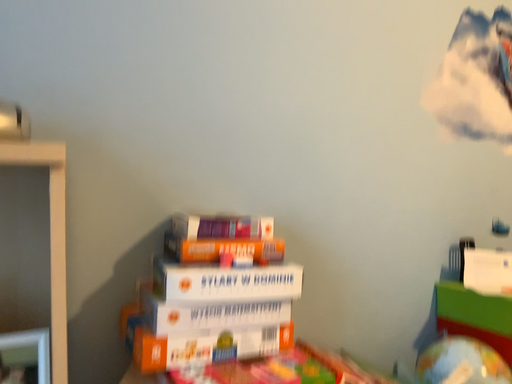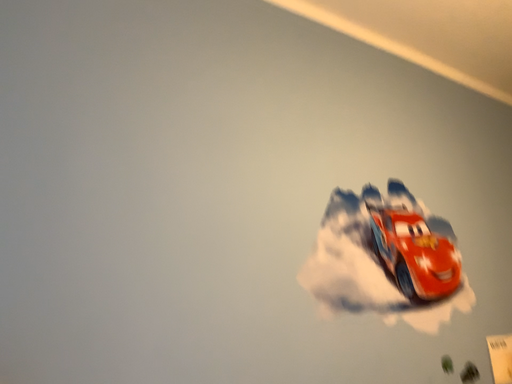
Question: Which way did the camera rotate in the video?

Choices:
 (A) rotated downward
 (B) rotated upward

Answer: (B)